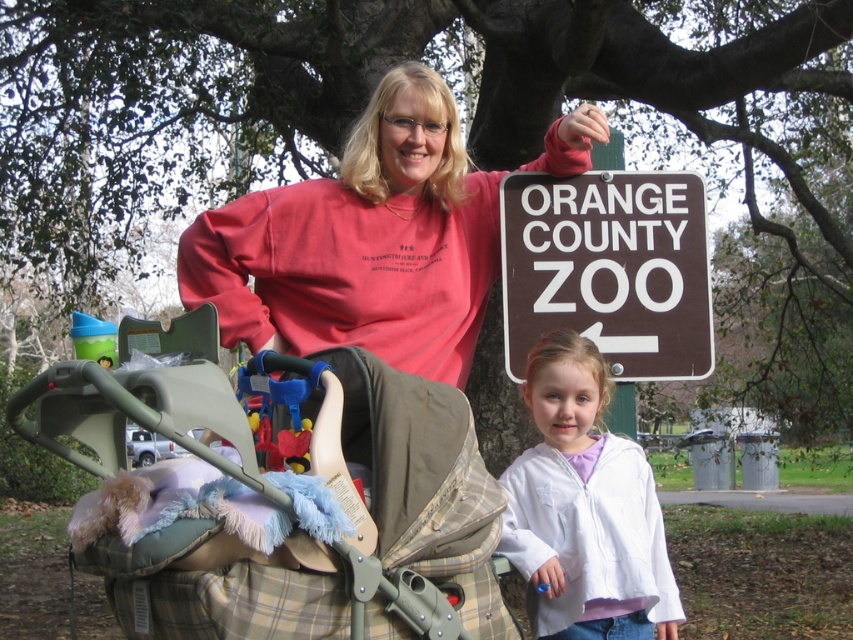
Is matte pink sweatshirt at center smaller than white fleece jacket at lower right?

Incorrect, matte pink sweatshirt at center is not smaller in size than white fleece jacket at lower right.

Does matte pink sweatshirt at center appear on the right side of white fleece jacket at lower right?

In fact, matte pink sweatshirt at center is to the left of white fleece jacket at lower right.

Is point (426, 145) less distant than point (541, 376)?

No, (426, 145) is behind (541, 376).

Where is `matte pink sweatshirt at center`? The width and height of the screenshot is (853, 640). matte pink sweatshirt at center is located at coordinates (361, 243).

Is matte pink sweatshirt at center further to camera compared to brownmaterial/texturesign at upper right?

No, it is not.

Does matte pink sweatshirt at center appear on the right side of brownmaterial/texturesign at upper right?

In fact, matte pink sweatshirt at center is to the left of brownmaterial/texturesign at upper right.

Does point (364, 125) come behind point (503, 301)?

No, it is in front of (503, 301).

Identify the location of matte pink sweatshirt at center. click(x=361, y=243).

Between plaid fabric baby carriage at center and matte pink sweatshirt at center, which one has more height?

matte pink sweatshirt at center

Who is lower down, plaid fabric baby carriage at center or matte pink sweatshirt at center?

plaid fabric baby carriage at center is lower down.

The image size is (853, 640). Find the location of `plaid fabric baby carriage at center`. plaid fabric baby carriage at center is located at coordinates (274, 497).